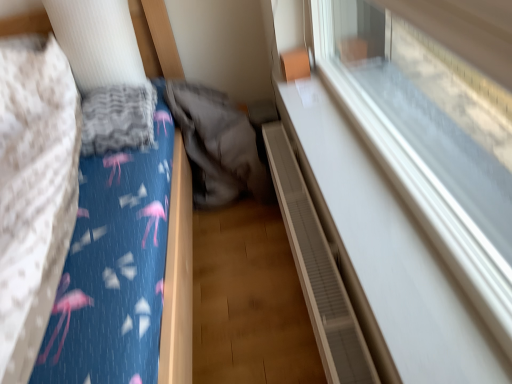
Locate an element on the screen. free point below transparent glass window at upper right (from a real-world perspective) is located at coordinates 366,177.